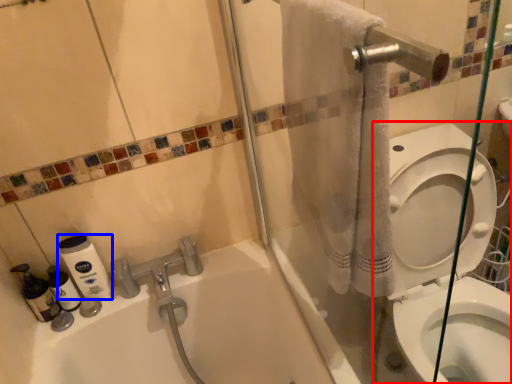
Question: Which object appears closest to the camera in this image, toilet (highlighted by a red box) or cleaning product (highlighted by a blue box)?

Choices:
 (A) toilet
 (B) cleaning product

Answer: (A)